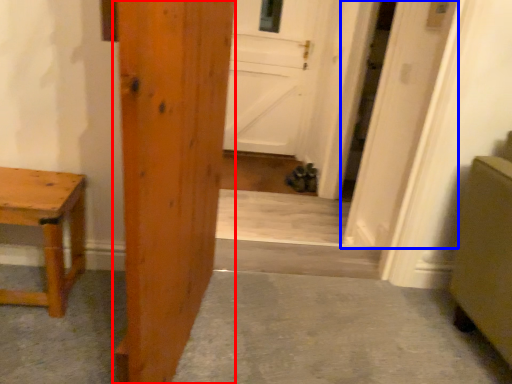
Question: Which of the following is the farthest to the observer, door (highlighted by a red box) or door (highlighted by a blue box)?

Choices:
 (A) door
 (B) door

Answer: (B)